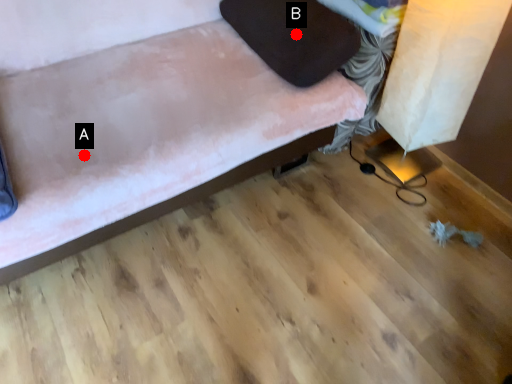
Question: Two points are circled on the image, labeled by A and B beside each circle. Which point is farther from the camera taking this photo?

Choices:
 (A) A is further
 (B) B is further

Answer: (B)